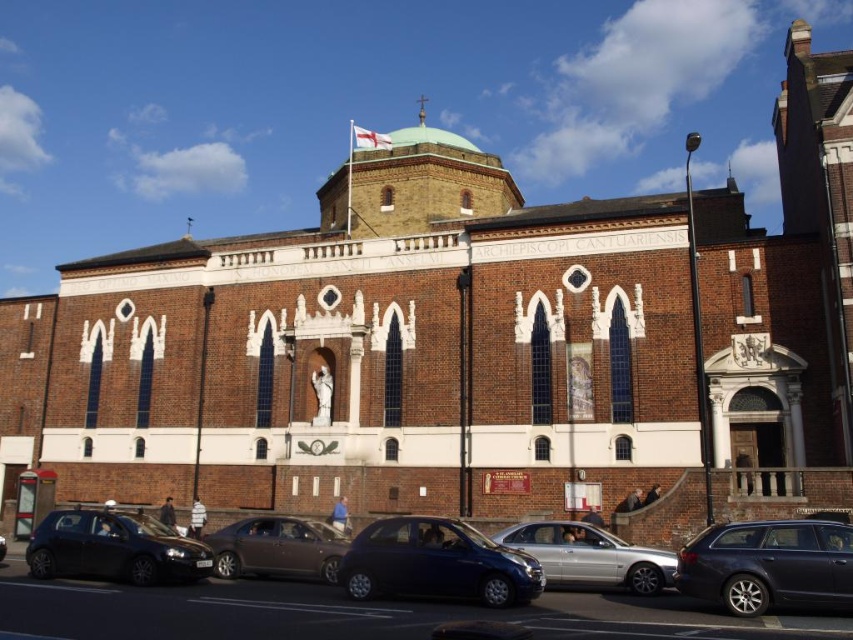
Does metallic blue car at center appear on the left side of matte brown sedan at center?

Incorrect, metallic blue car at center is not on the left side of matte brown sedan at center.

Does metallic blue car at center have a greater width compared to matte brown sedan at center?

In fact, metallic blue car at center might be narrower than matte brown sedan at center.

Is point (486, 579) positioned before point (204, 538)?

Yes, it is.

Locate an element on the screen. metallic blue car at center is located at coordinates (436, 563).

Measure the distance between point (811, 600) and camera.

Point (811, 600) and camera are 30.29 meters apart.

Looking at this image, between dark gray metallic station wagon at lower right and silver metallic sedan at center, which one has more height?

With more height is silver metallic sedan at center.

Is point (788, 573) positioned before point (497, 536)?

Yes, it is in front of point (497, 536).

I want to click on dark gray metallic station wagon at lower right, so click(769, 564).

Does dark gray metallic station wagon at lower right have a lesser width compared to shiny black car at lower left?

Yes, dark gray metallic station wagon at lower right is thinner than shiny black car at lower left.

Is point (796, 593) farther from viewer compared to point (54, 570)?

No, it is in front of (54, 570).

Where is `dark gray metallic station wagon at lower right`? Image resolution: width=853 pixels, height=640 pixels. dark gray metallic station wagon at lower right is located at coordinates (769, 564).